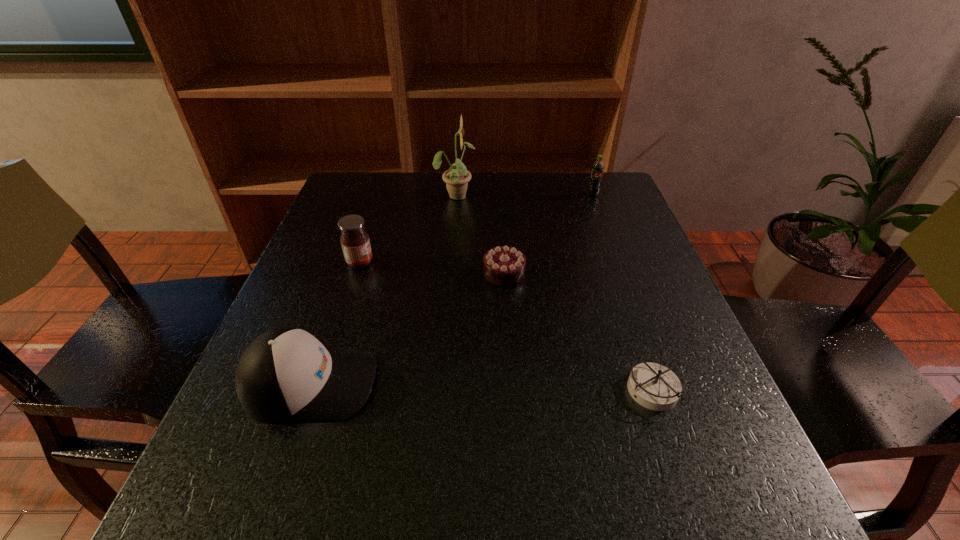
This screenshot has width=960, height=540. I want to click on the tallest object, so click(457, 177).

Identify the location of the fourth object from right to left. The width and height of the screenshot is (960, 540). (457, 177).

The width and height of the screenshot is (960, 540). I want to click on soda, so click(x=597, y=169).

You are a GUI agent. You are given a task and a screenshot of the screen. Output one action in this format:
    pyautogui.click(x=<x>, y=<y>)
    Task: Click on the jam
    The width and height of the screenshot is (960, 540).
    Given the screenshot: What is the action you would take?
    pyautogui.click(x=355, y=242)

Locate an element on the screen. Image resolution: width=960 pixels, height=540 pixels. cap is located at coordinates (286, 374).

Identify the location of compass. (654, 386).

This screenshot has height=540, width=960. What are the coordinates of `the third object from right to left` in the screenshot? It's located at (504, 266).

Where is `vacant space located 0.250m on the front-facing side of the sunflower`? vacant space located 0.250m on the front-facing side of the sunflower is located at coordinates (565, 195).

At what (x,y) coordinates should I click in order to perform the action: click on vacant region located 0.360m on the front label of the soda. Please return your answer as a coordinate pair (x, y). This screenshot has height=540, width=960. Looking at the image, I should click on [627, 285].

This screenshot has width=960, height=540. Find the location of `free location located on the label side of the jam`. free location located on the label side of the jam is located at coordinates 484,263.